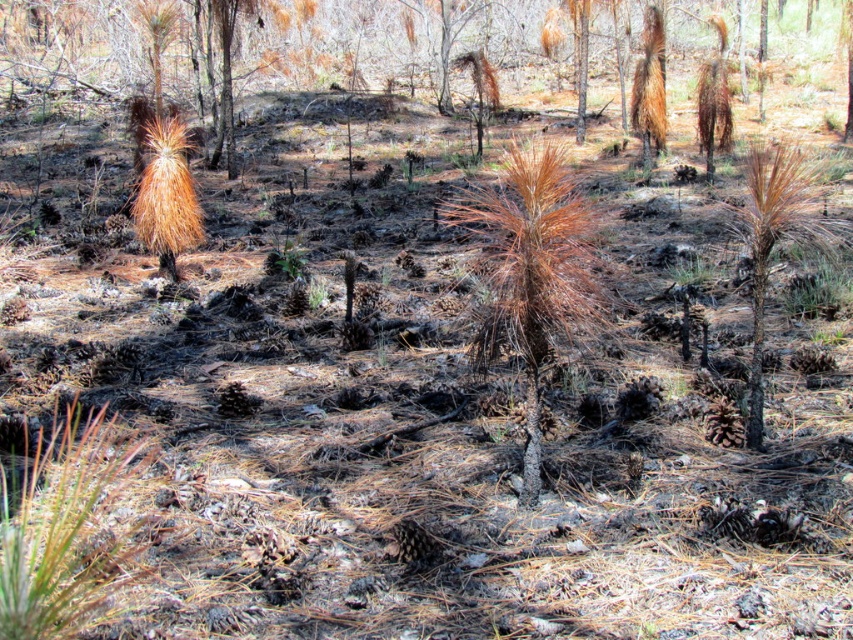
Is the position of brown/dry pine tree at center less distant than that of brown/dried wood tree at center?

Yes, it is.

Is brown/dry pine tree at center thinner than brown/dried wood tree at center?

In fact, brown/dry pine tree at center might be wider than brown/dried wood tree at center.

This screenshot has height=640, width=853. What are the coordinates of `brown/dry pine tree at center` in the screenshot? It's located at (531, 273).